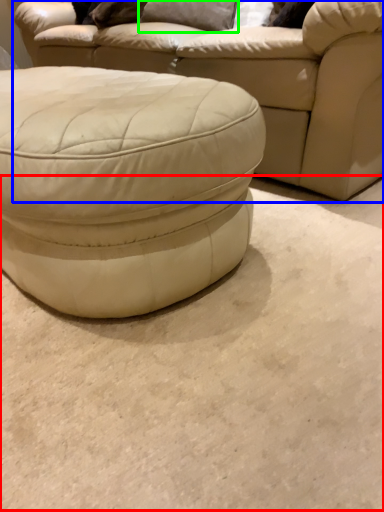
Question: Which object is the closest to the concrete (highlighted by a red box)? Choose among these: studio couch (highlighted by a blue box) or pillow (highlighted by a green box).

Choices:
 (A) studio couch
 (B) pillow

Answer: (A)